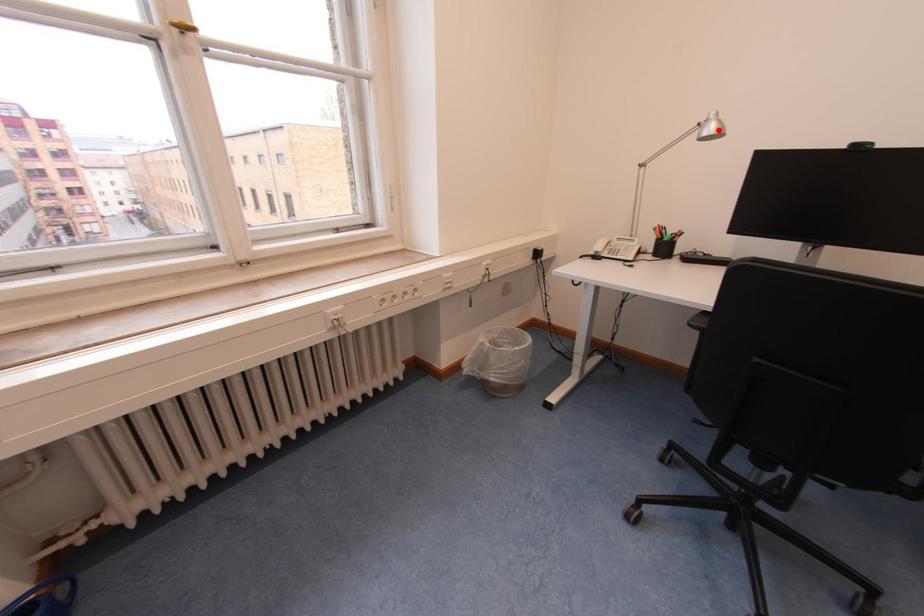
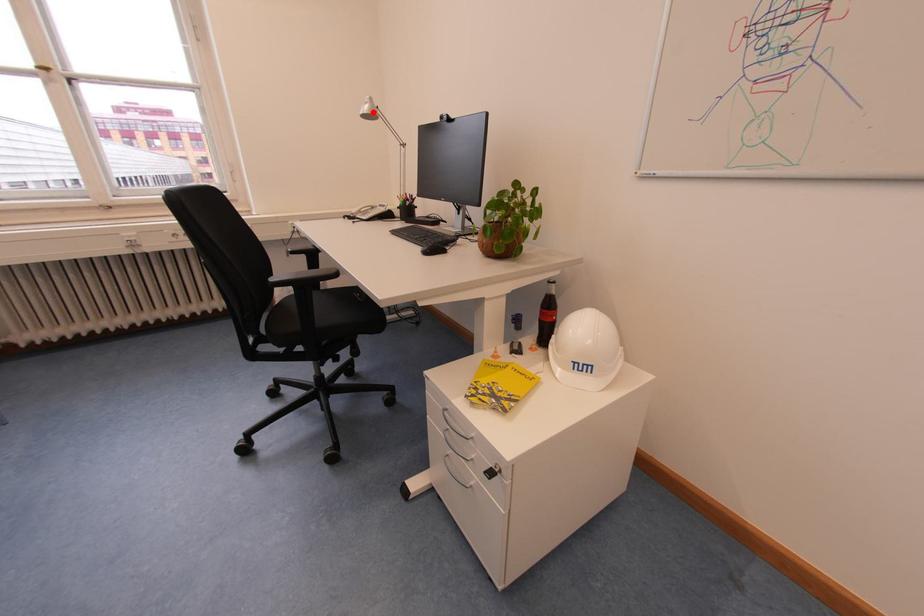
I am providing you with two images of the same scene from different viewpoints. A red point is marked on the first image and another point is marked on the second image. Is the red point in image1 aligned with the point shown in image2?

Yes